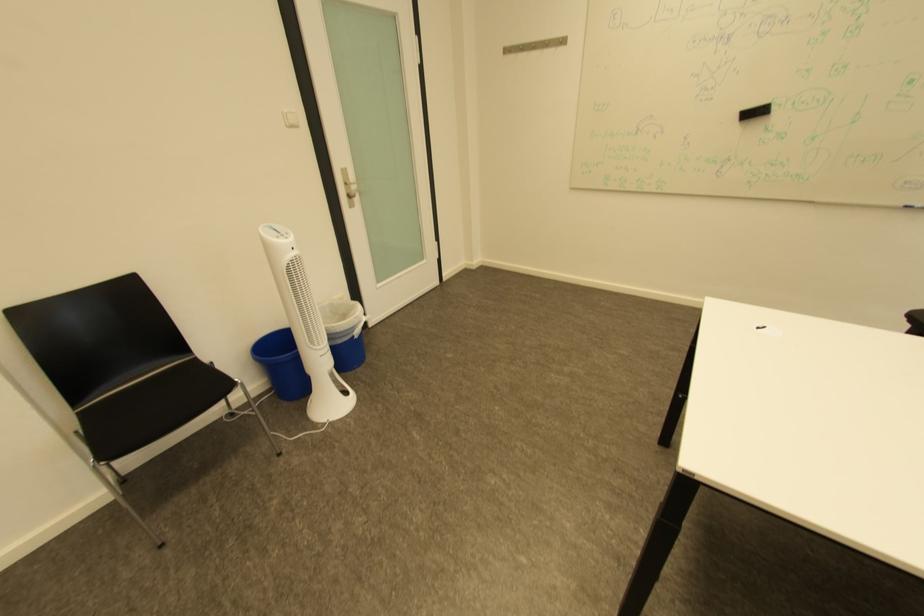
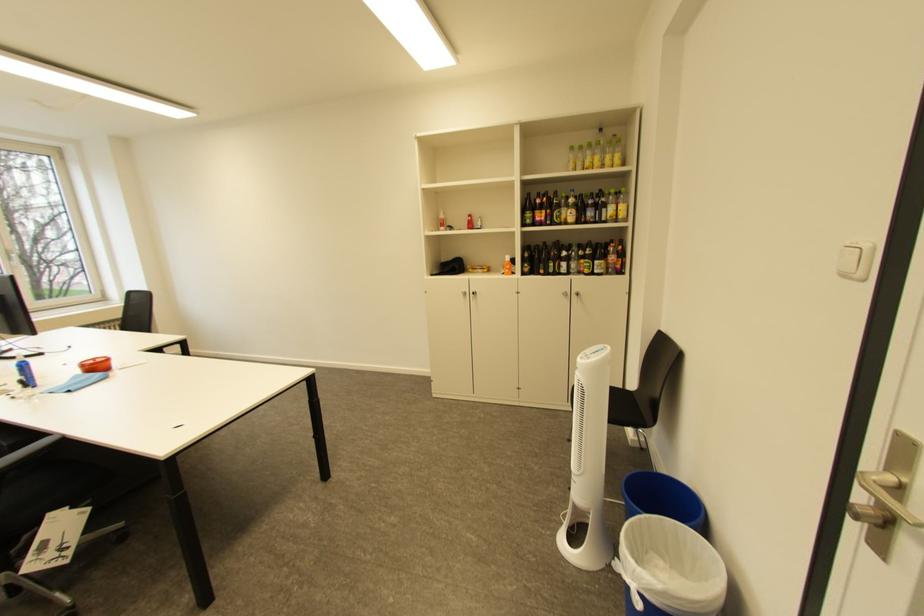
Find the pixel in the second image that matches (x=295, y=240) in the first image.

(591, 359)